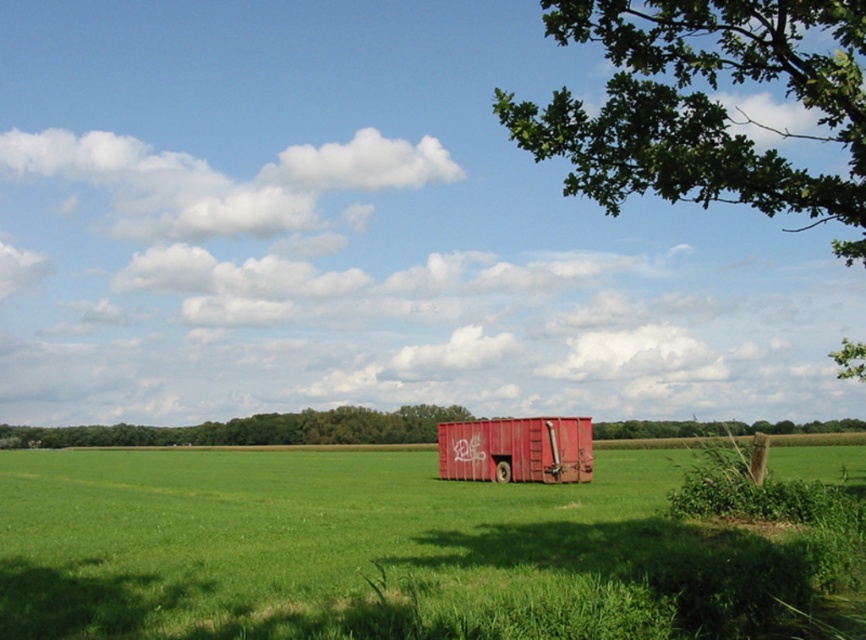
Is green leafy tree at lower right positioned behind rusty metal train car at center?

Yes, green leafy tree at lower right is behind rusty metal train car at center.

Who is taller, green leafy tree at lower right or rusty metal train car at center?

green leafy tree at lower right is taller.

Between point (86, 429) and point (587, 438), which one is positioned in front?

Point (587, 438)

You are a GUI agent. You are given a task and a screenshot of the screen. Output one action in this format:
    pyautogui.click(x=<x>, y=<y>)
    Task: Click on the green leafy tree at lower right
    This screenshot has height=640, width=866.
    Given the screenshot: What is the action you would take?
    pyautogui.click(x=256, y=429)

Is green grassy field at center thinner than green leafy tree at upper right?

No, green grassy field at center is not thinner than green leafy tree at upper right.

Is point (170, 618) more distant than point (625, 113)?

No, it is in front of (625, 113).

Image resolution: width=866 pixels, height=640 pixels. I want to click on green grassy field at center, so (369, 552).

Between green leafy tree at upper right and green leafy tree at lower right, which one has less height?

green leafy tree at lower right

Can you confirm if green leafy tree at upper right is thinner than green leafy tree at lower right?

Yes, green leafy tree at upper right is thinner than green leafy tree at lower right.

Find the location of a particular element. green leafy tree at upper right is located at coordinates (703, 106).

Identify the location of green leafy tree at upper right. (703, 106).